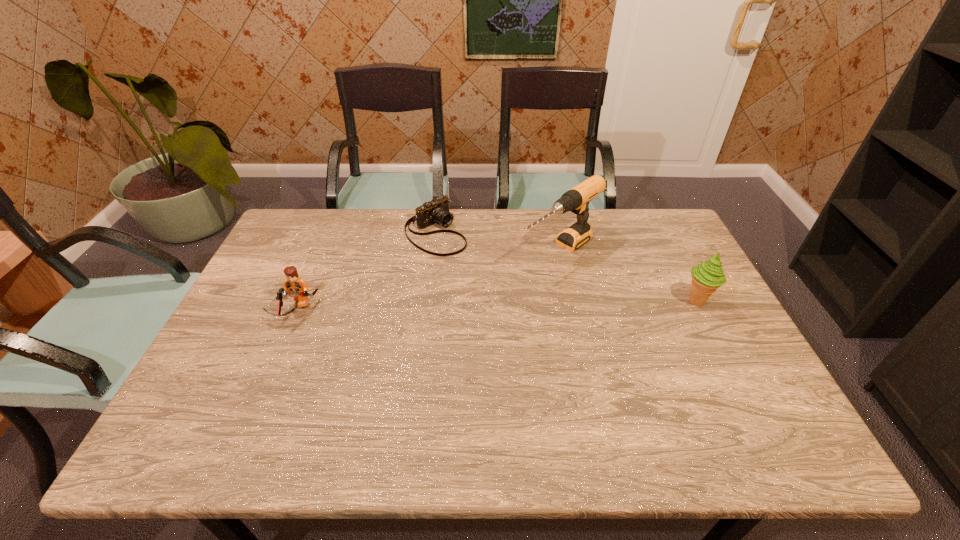
Identify the location of Lego. (294, 285).

In order to click on the leftmost object in this screenshot , I will do `click(294, 285)`.

At what (x,y) coordinates should I click in order to perform the action: click on the second tallest object. Please return your answer as a coordinate pair (x, y). Image resolution: width=960 pixels, height=540 pixels. Looking at the image, I should click on (706, 277).

You are a GUI agent. You are given a task and a screenshot of the screen. Output one action in this format:
    pyautogui.click(x=<x>, y=<y>)
    Task: Click on the rightmost object
    
    Given the screenshot: What is the action you would take?
    pyautogui.click(x=706, y=277)

Image resolution: width=960 pixels, height=540 pixels. Identify the location of the tallest object. (576, 200).

Identify the location of drill. The image size is (960, 540). (576, 200).

Locate an element on the screen. camera is located at coordinates (436, 211).

You are a GUI agent. You are given a task and a screenshot of the screen. Output one action in this format:
    pyautogui.click(x=<x>, y=<y>)
    Task: Click on the shortest object
    The image size is (960, 540).
    Given the screenshot: What is the action you would take?
    pyautogui.click(x=436, y=211)

Find the location of a particular element. This screenshot has height=540, width=960. free region located 0.240m holding a crossbow in the hands of the second shortest object is located at coordinates (253, 406).

Identify the location of blank area located on the back of the rightmost object. (680, 268).